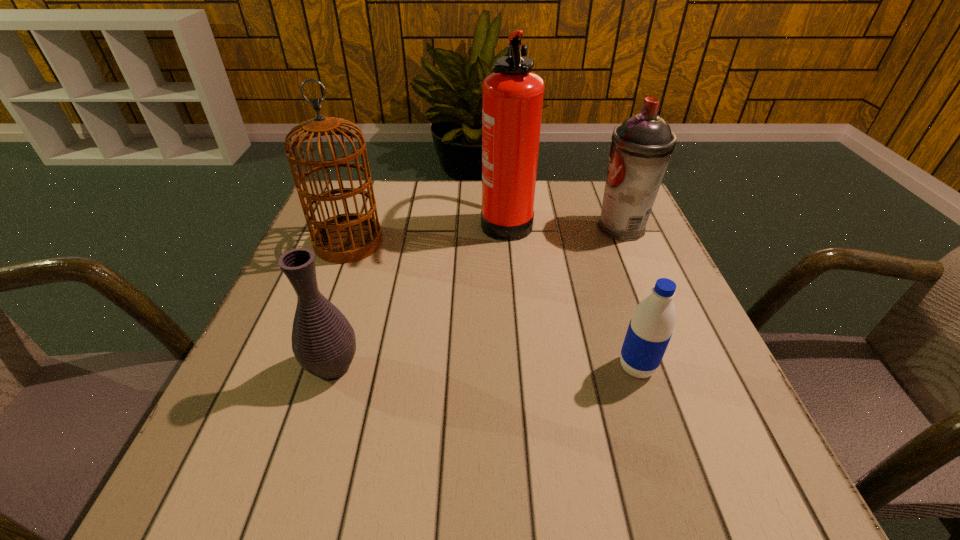
Find the location of `free space between the shortest object and the third tallest object`. free space between the shortest object and the third tallest object is located at coordinates (629, 298).

I want to click on vacant area that lies between the water bottle and the tallest object, so click(x=571, y=293).

What are the coordinates of `free space between the aerosol can and the second tallest object` in the screenshot? It's located at (485, 235).

Find the location of a particular element. This screenshot has height=540, width=960. vacant area that lies between the tallest object and the second tallest object is located at coordinates (427, 231).

The height and width of the screenshot is (540, 960). Identify the location of unoccupied area between the aerosol can and the fourth shortest object. (485, 235).

Where is `blank region between the fourth shortest object and the third shortest object`? This screenshot has height=540, width=960. blank region between the fourth shortest object and the third shortest object is located at coordinates (485, 235).

Where is `vacant area that lies between the birdcage and the shortest object`? vacant area that lies between the birdcage and the shortest object is located at coordinates (492, 305).

Locate an element on the screen. The height and width of the screenshot is (540, 960). object that is the fourth closest to the aerosol can is located at coordinates (323, 341).

Point out which object is positioned as the second nearest to the water bottle. Please provide its 2D coordinates. Your answer should be formatted as a tuple, i.e. [(x, y)], where the tuple contains the x and y coordinates of a point satisfying the conditions above.

[(512, 96)]

Where is `vacant area in the image that satisfies the following two spatial constraints: 1. at the nozzle of the third object from left to right; 2. on the left side of the aerosol can`? vacant area in the image that satisfies the following two spatial constraints: 1. at the nozzle of the third object from left to right; 2. on the left side of the aerosol can is located at coordinates (507, 227).